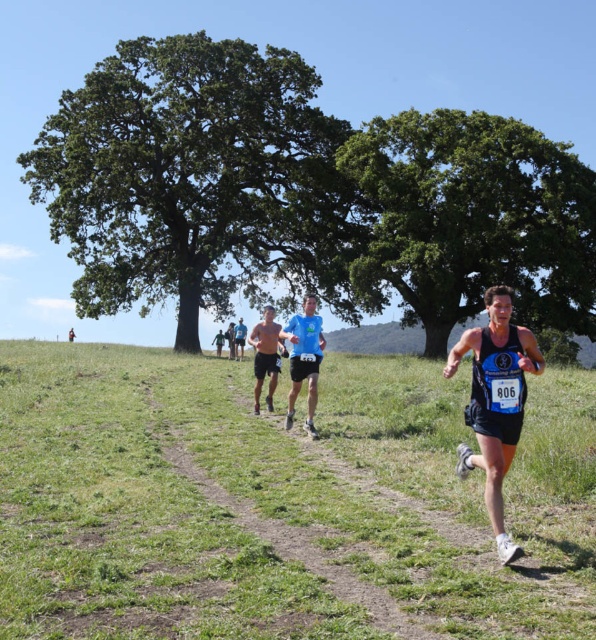
You are a photographer trying to capture the runners in the cross country race. You notice the green grass at center and the matte skin running at center. Which object in the scene takes up more visual space in the image?

The green grass at center takes up more visual space in the image because it is bigger than the matte skin running at center.

You are a spectator at the cross country race. You notice the light blue fabric shirt at center and the green leafy tree at upper left. Which object is closer to you?

Result: The green leafy tree at upper left is closer to you because the light blue fabric shirt at center is behind it.